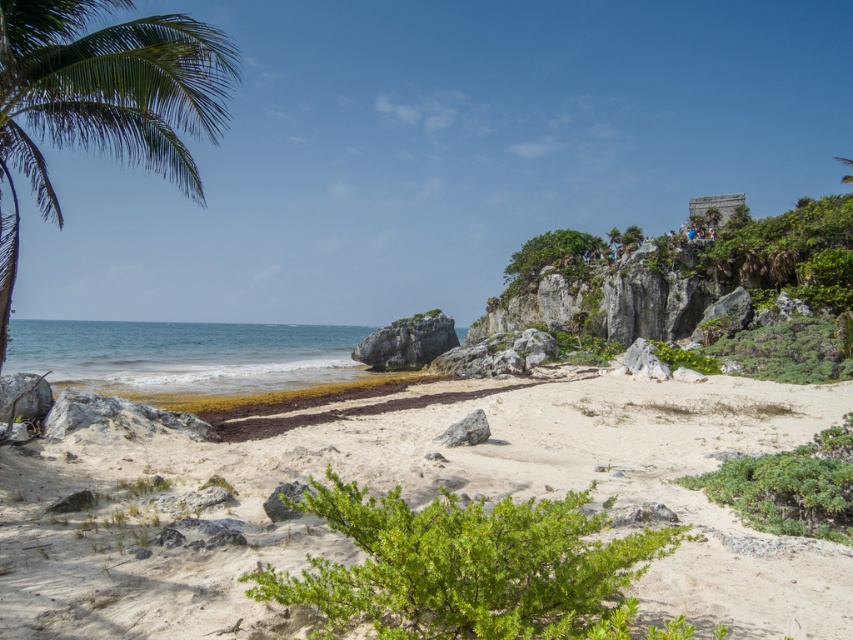
Does white sandy beach at center appear on the right side of green leafy palm tree at left?

Yes, white sandy beach at center is to the right of green leafy palm tree at left.

You are a GUI agent. You are given a task and a screenshot of the screen. Output one action in this format:
    pyautogui.click(x=<x>, y=<y>)
    Task: Click on the white sandy beach at center
    This screenshot has width=853, height=640.
    Given the screenshot: What is the action you would take?
    pyautogui.click(x=410, y=504)

Does green leafy palm tree at left come in front of smooth gray rock at center?

Yes, green leafy palm tree at left is closer to the viewer.

In the scene shown: Which is more to the left, green leafy palm tree at left or smooth gray rock at center?

Positioned to the left is green leafy palm tree at left.

Who is more forward, (88, 74) or (488, 435)?

Point (88, 74) is in front.

At what (x,y) coordinates should I click in order to perform the action: click on green leafy palm tree at left. Please return your answer as a coordinate pair (x, y). This screenshot has height=640, width=853. Looking at the image, I should click on (102, 100).

Who is lower down, white sandy beach at center or smooth gray rock at center?

Positioned lower is white sandy beach at center.

The height and width of the screenshot is (640, 853). I want to click on white sandy beach at center, so click(410, 504).